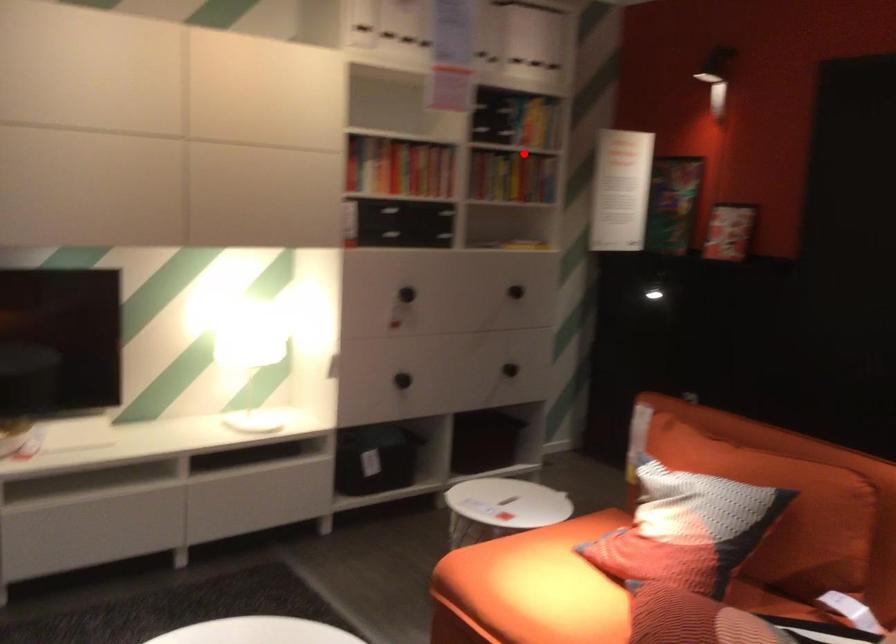
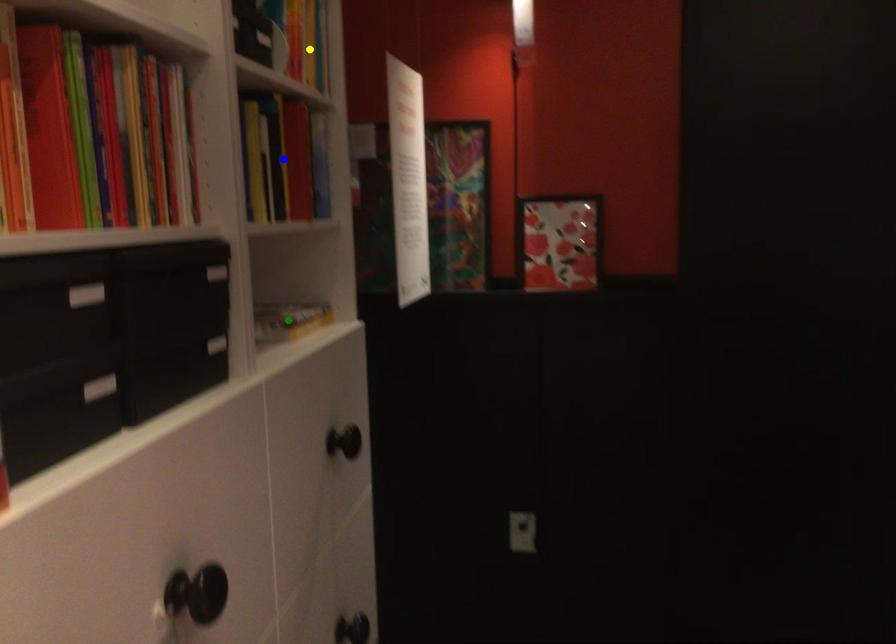
Question: I am providing you with two images of the same scene from different viewpoints. A red point is marked on the first image. You are given multiple points on the second image. In image 2, which mark is for the same physical point as the one in image 1?

Choices:
 (A) yellow point
 (B) green point
 (C) blue point

Answer: (C)